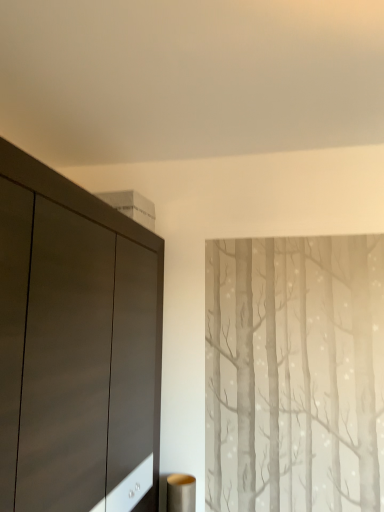
Where is `matte black cupboard at left`? This screenshot has height=512, width=384. matte black cupboard at left is located at coordinates (76, 347).

The height and width of the screenshot is (512, 384). What do you see at coordinates (76, 347) in the screenshot?
I see `matte black cupboard at left` at bounding box center [76, 347].

You are a GUI agent. You are given a task and a screenshot of the screen. Output one action in this format:
    pyautogui.click(x=<x>, y=<y>)
    Task: Click on the matte black cupboard at left
    
    Given the screenshot: What is the action you would take?
    pyautogui.click(x=76, y=347)